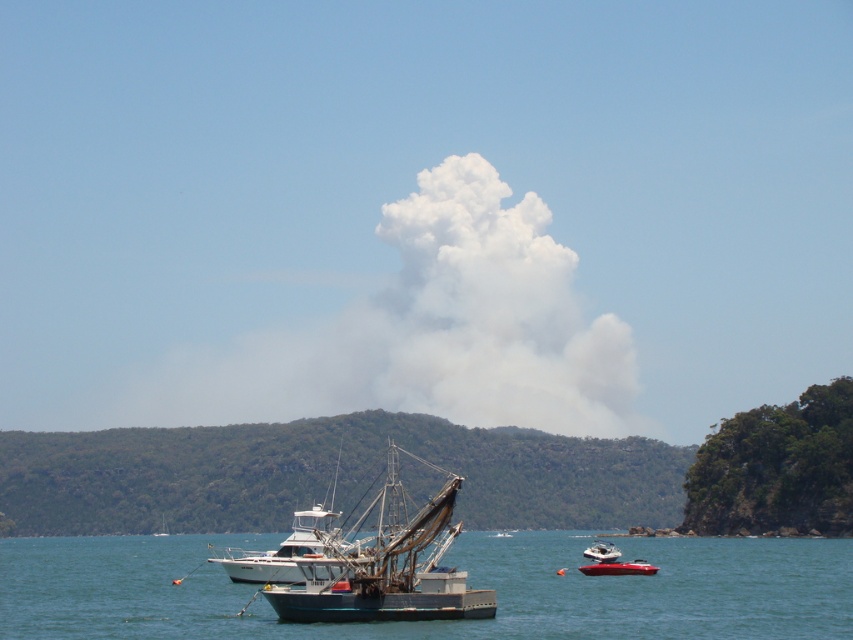
Question: Does transparent blue water at center have a lesser width compared to blue metallic fishing boat at center?

Choices:
 (A) no
 (B) yes

Answer: (A)

Question: Which object appears closest to the camera in this image?

Choices:
 (A) blue metallic fishing boat at center
 (B) white plastic boat at center

Answer: (A)

Question: Which of the following is the closest to the observer?

Choices:
 (A) white smoke cloud at center
 (B) blue metallic fishing boat at center

Answer: (B)

Question: Which object appears closest to the camera in this image?

Choices:
 (A) white plastic boat at center
 (B) metallic silver boat at lower right
 (C) transparent blue water at center

Answer: (C)

Question: Considering the relative positions of metallic silver boat at lower right and white plastic boat at center in the image provided, where is metallic silver boat at lower right located with respect to white plastic boat at center?

Choices:
 (A) right
 (B) left

Answer: (B)

Question: Where is transparent blue water at center located in relation to blue metallic fishing boat at center in the image?

Choices:
 (A) right
 (B) left

Answer: (B)